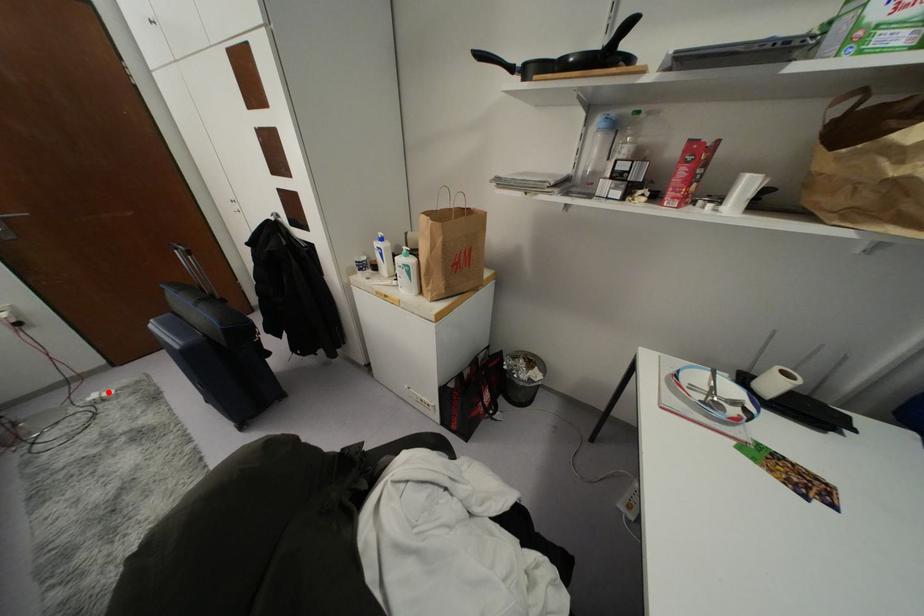
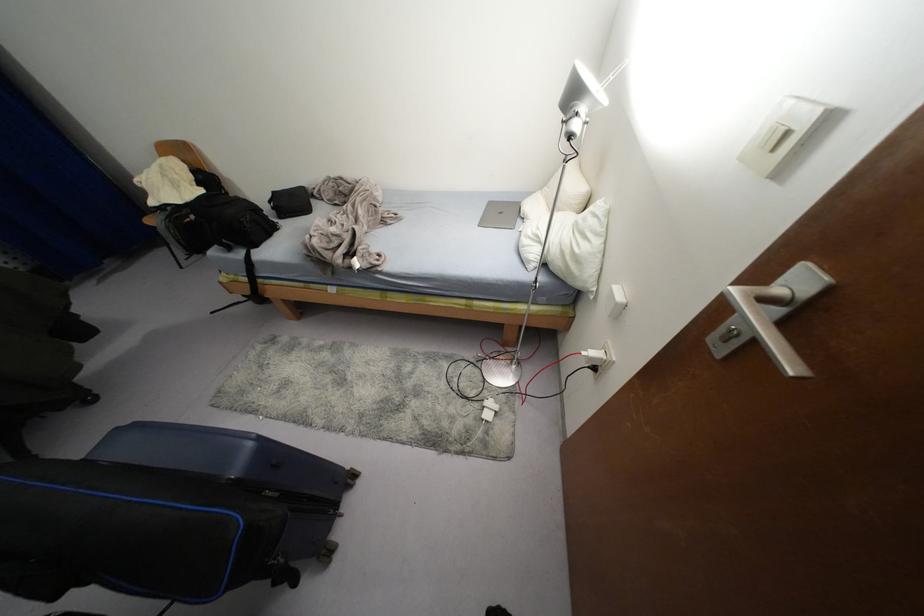
Find the pixel in the second image that matches the highlighted location in the first image.

(487, 416)